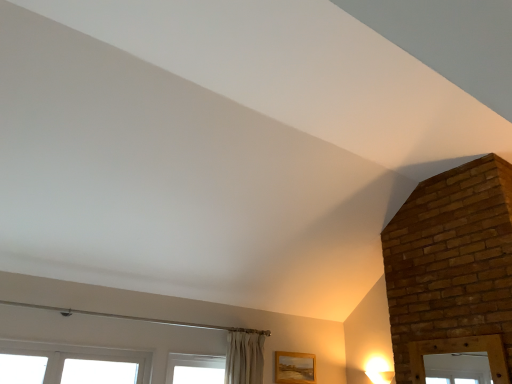
Question: Does point (312, 374) appear closer or farther from the camera than point (146, 369)?

Choices:
 (A) farther
 (B) closer

Answer: (A)

Question: Is wooden frame at lower right inside the boundaries of white plastic window at lower left, or outside?

Choices:
 (A) inside
 (B) outside

Answer: (B)

Question: Which is farther from the wooden frame at lower right?

Choices:
 (A) white plastic window at lower left
 (B) matte white light fixture at lower right

Answer: (A)

Question: Based on their relative distances, which object is farther from the matte white light fixture at lower right?

Choices:
 (A) wooden frame at lower right
 (B) white plastic window at lower left

Answer: (B)